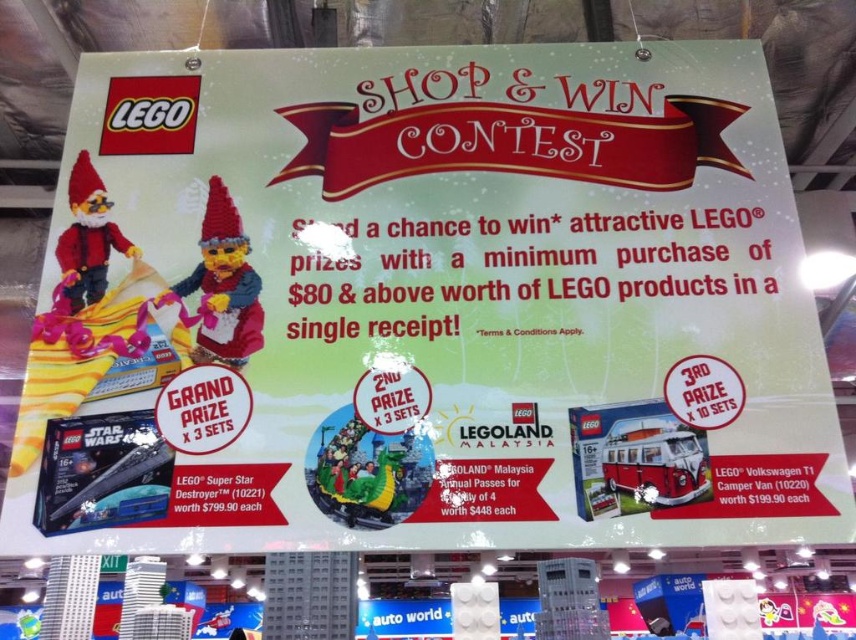
Question: Which point is closer to the camera taking this photo?

Choices:
 (A) (97, 266)
 (B) (637, 474)

Answer: (B)

Question: Which of the following is the closest to the observer?

Choices:
 (A) (203, 308)
 (B) (602, 474)
 (C) (82, 173)

Answer: (B)

Question: Which point is farther to the camera?

Choices:
 (A) (125, 250)
 (B) (687, 490)
 (C) (223, 212)

Answer: (C)

Question: Is knitted woolen gnome at center below matte plastic gnome at upper left?

Choices:
 (A) no
 (B) yes

Answer: (B)

Question: Is knitted woolen gnome at center thinner than matte plastic gnome at upper left?

Choices:
 (A) no
 (B) yes

Answer: (A)

Question: From the image, what is the correct spatial relationship of knitted woolen gnome at center in relation to red matte lego volkswagen t1 camper van at center?

Choices:
 (A) above
 (B) below

Answer: (A)